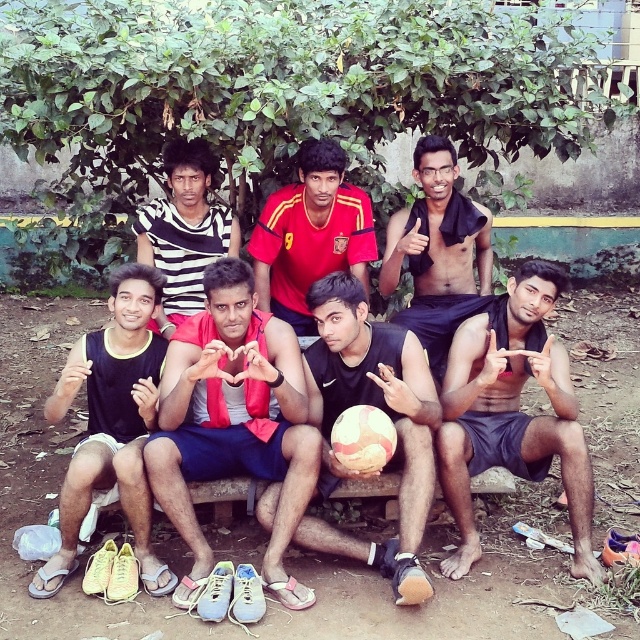
You are organizing a sports event and need to decide which item to use for covering equipment. The shiny black towel at center and the striped fabric shirt at center are available. Which item would be more suitable for covering equipment based on their sizes?

The shiny black towel at center is larger than the striped fabric shirt at center, making it more suitable for covering equipment.

You are part of the group in the image and want to hand the shiny black towel at center to the person wearing the striped fabric shirt at center. Since both items are at center, can you directly hand it to them without moving either item?

The shiny black towel at center is to the right of the striped fabric shirt at center, so you can hand it directly without moving either item as they are positioned next to each other at center.

Based on the photo, you are standing at point A, which is located at coordinates point A at (460, 212). You want to walk to the concrete wall in the background. Is there enough space between the group of seven young men arranged in two rows to reach the wall without disturbing them?

The group of seven young men arranged in two rows are 4.66 meters apart. Since you are at point A at (460, 212), you can walk through the space between them to reach the concrete wall in the background as long as the distance allows passage. However, the exact path depends on their arrangement, but the 4.66 meters gap suggests sufficient space.